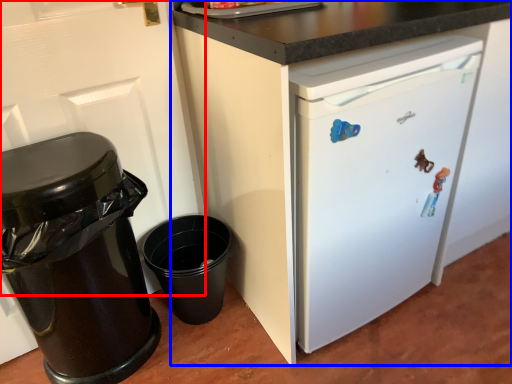
Question: Which object is further to the camera taking this photo, door (highlighted by a red box) or cabinetry (highlighted by a blue box)?

Choices:
 (A) door
 (B) cabinetry

Answer: (A)